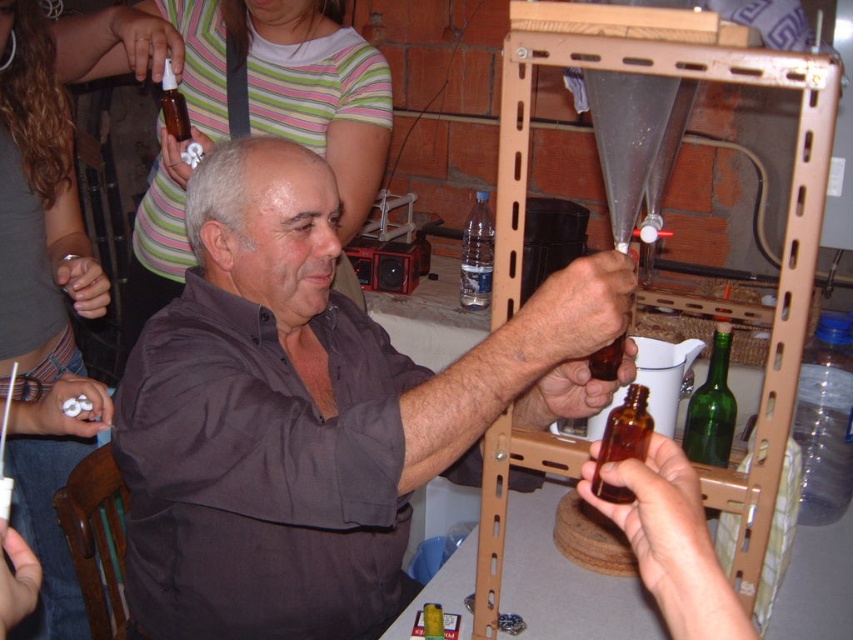
You are organizing a science fair and need to choose between the transparent plastic bottle at right and the green glass bottle at center for a demonstration. Which bottle should you select if you need the taller container?

The transparent plastic bottle at right has a greater height compared to the green glass bottle at center, so you should select the transparent plastic bottle at right for the demonstration.